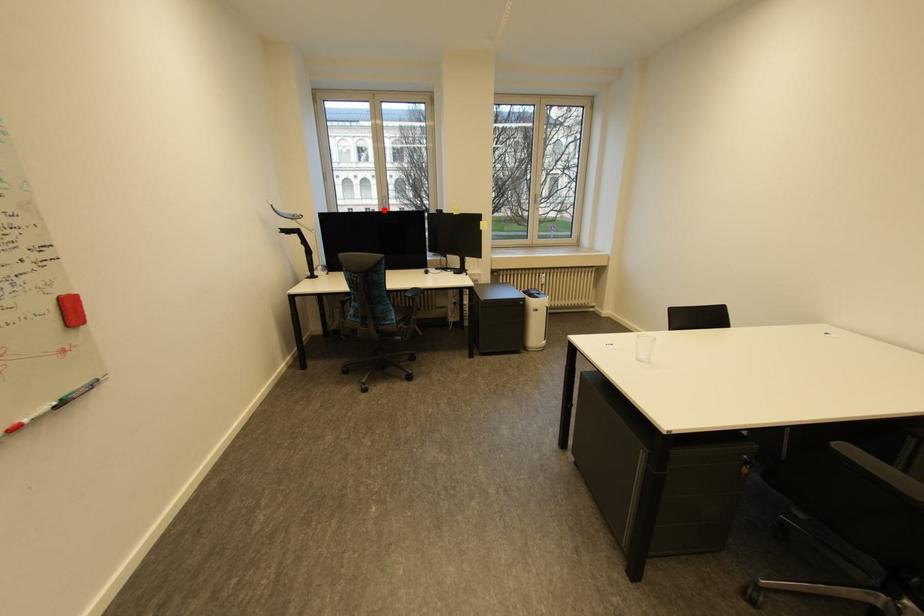
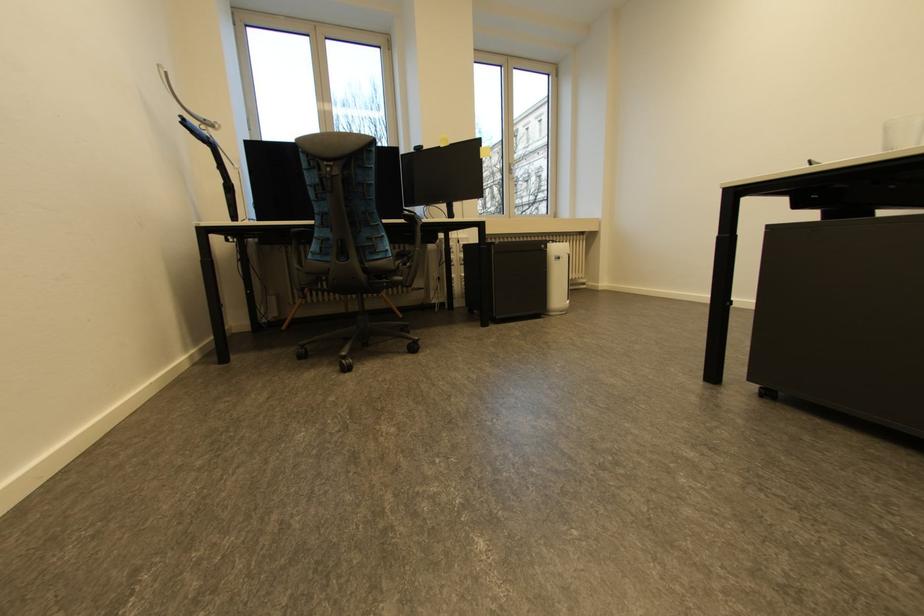
Question: I am providing you with two images of the same scene from different viewpoints. A red point is marked on the first image. Can you still see the location of the red point in image 2?

Choices:
 (A) Yes
 (B) No

Answer: (B)